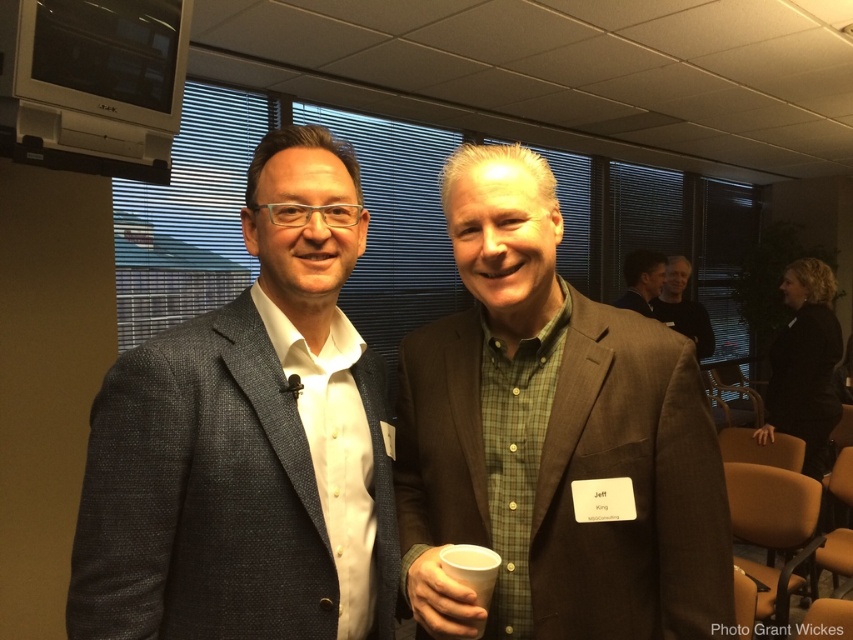
Question: Among these objects, which one is nearest to the camera?

Choices:
 (A) dark gray suit at upper right
 (B) white paper cup at center
 (C) matte gray blazer at left

Answer: (B)

Question: Does black textured blazer at center lie behind white paper cup at center?

Choices:
 (A) no
 (B) yes

Answer: (B)

Question: Does brown textured suit at center appear on the right side of white paper cup at center?

Choices:
 (A) yes
 (B) no

Answer: (A)

Question: Is brown textured suit at center thinner than black textured blazer at center?

Choices:
 (A) yes
 (B) no

Answer: (A)

Question: Which of the following is the closest to the observer?

Choices:
 (A) brown textured suit at center
 (B) black textured blazer at center
 (C) dark gray suit at upper right

Answer: (A)

Question: Which point is farther from the camera taking this photo?

Choices:
 (A) (669, 269)
 (B) (830, 360)

Answer: (A)